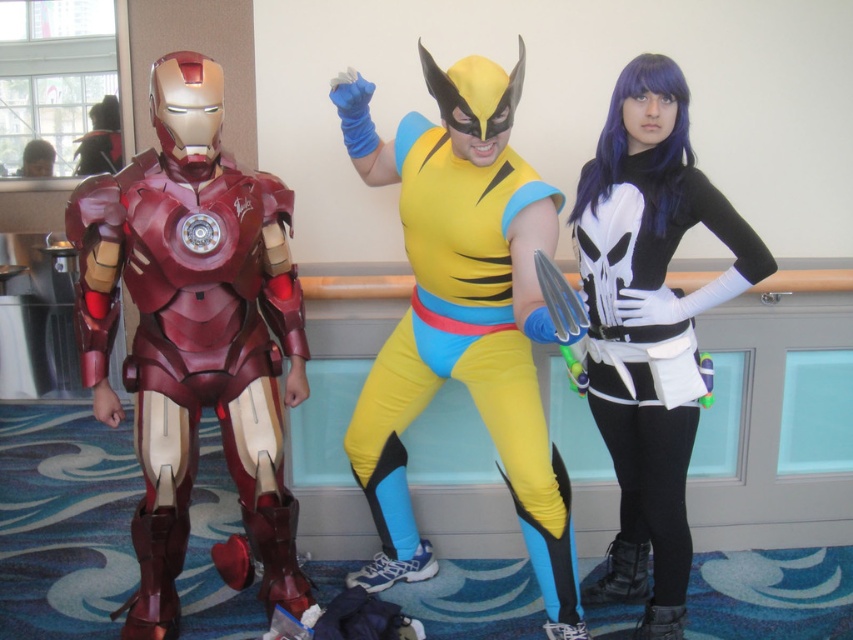
Question: Which of the following is the closest to the observer?

Choices:
 (A) shiny metallic armor at left
 (B) yellow spandex suit at center
 (C) black matte punisher costume at right

Answer: (B)

Question: Among these objects, which one is farthest from the camera?

Choices:
 (A) black matte punisher costume at right
 (B) shiny metallic armor at left
 (C) yellow spandex suit at center

Answer: (A)

Question: Does shiny metallic armor at left appear on the right side of black matte punisher costume at right?

Choices:
 (A) yes
 (B) no

Answer: (B)

Question: Based on their relative distances, which object is farther from the yellow spandex suit at center?

Choices:
 (A) black matte punisher costume at right
 (B) shiny metallic armor at left

Answer: (B)

Question: Can you confirm if shiny metallic armor at left is positioned below yellow spandex suit at center?

Choices:
 (A) no
 (B) yes

Answer: (B)

Question: Does shiny metallic armor at left have a lesser width compared to black matte punisher costume at right?

Choices:
 (A) no
 (B) yes

Answer: (A)